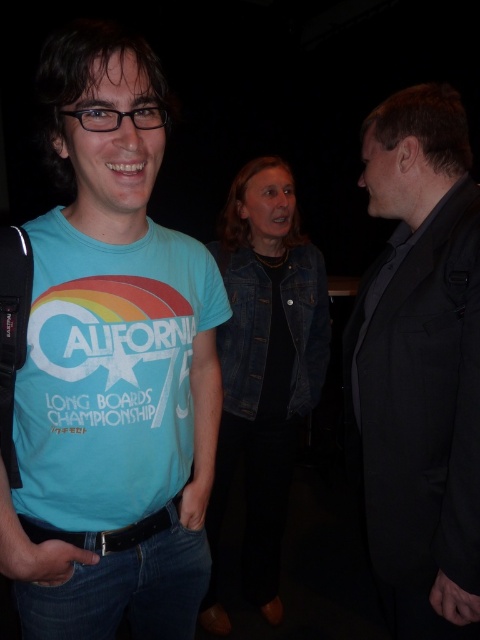
Question: Is black smooth suit at right smaller than denim jacket at center?

Choices:
 (A) yes
 (B) no

Answer: (A)

Question: Among these objects, which one is nearest to the camera?

Choices:
 (A) matte blue t-shirt at left
 (B) black smooth suit at right
 (C) denim jacket at center

Answer: (A)

Question: Which point is farther from the camera taking this photo?

Choices:
 (A) (373, 344)
 (B) (254, 513)

Answer: (B)

Question: Which point is farther to the camera?

Choices:
 (A) black smooth suit at right
 (B) denim jacket at center

Answer: (B)

Question: Is matte blue t-shirt at left closer to the viewer compared to black smooth suit at right?

Choices:
 (A) yes
 (B) no

Answer: (A)

Question: Does black smooth suit at right appear on the left side of denim jacket at center?

Choices:
 (A) yes
 (B) no

Answer: (B)